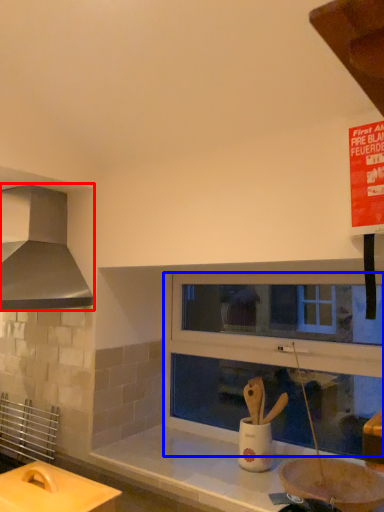
Question: Which object appears closest to the camera in this image, kitchen appliance (highlighted by a red box) or window frame (highlighted by a blue box)?

Choices:
 (A) kitchen appliance
 (B) window frame

Answer: (A)